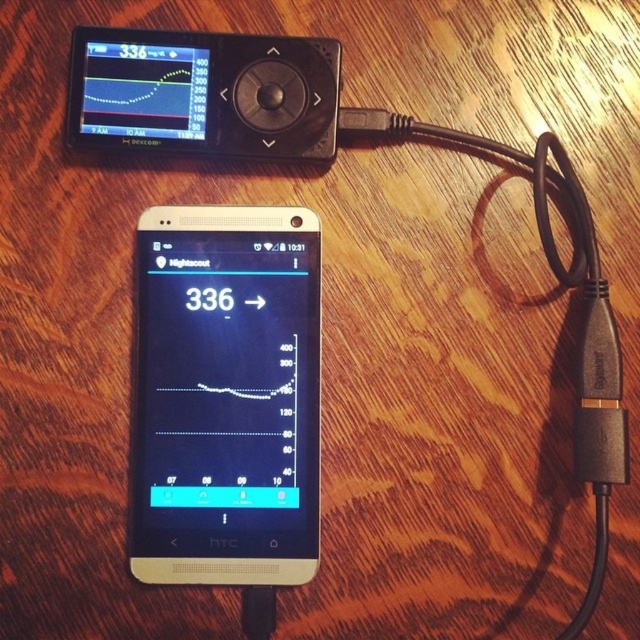
Question: Is matte black phone at center wider than matte black device at upper left?

Choices:
 (A) no
 (B) yes

Answer: (A)

Question: Estimate the real-world distances between objects in this image. Which object is farther from the matte black device at upper left?

Choices:
 (A) black rubber cable at lower right
 (B) matte black phone at center

Answer: (A)

Question: Which object is the closest to the matte black phone at center?

Choices:
 (A) matte black device at upper left
 (B) black rubber cable at lower right

Answer: (A)

Question: Is matte black device at upper left bigger than black rubber cable at lower right?

Choices:
 (A) no
 (B) yes

Answer: (A)

Question: Is matte black phone at center to the right of matte black device at upper left from the viewer's perspective?

Choices:
 (A) yes
 (B) no

Answer: (A)

Question: Which of the following is the closest to the observer?

Choices:
 (A) pyautogui.click(x=228, y=556)
 (B) pyautogui.click(x=541, y=230)
 (C) pyautogui.click(x=316, y=100)

Answer: (B)